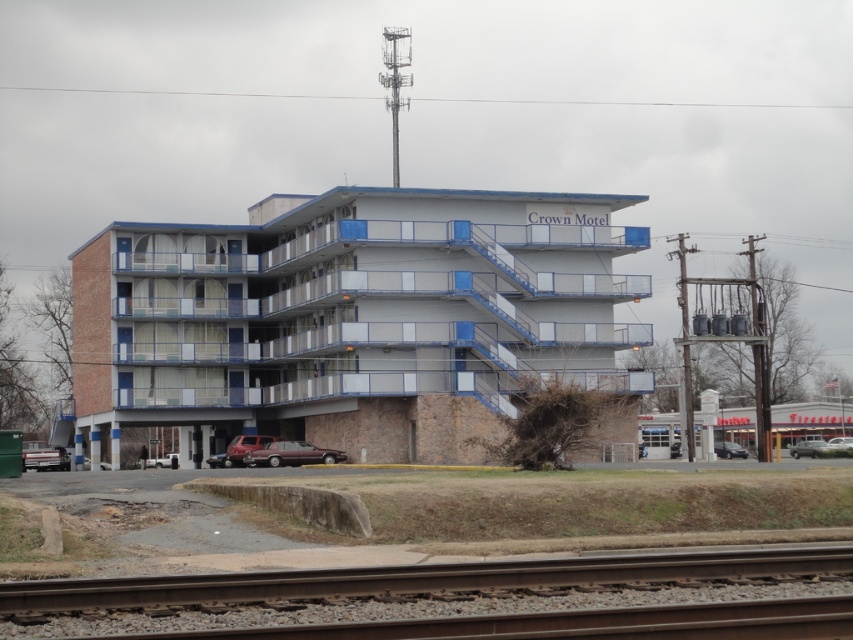
Question: Can you confirm if maroon metallic sedan at center is bigger than dark gray metallic sedan at lower right?

Choices:
 (A) no
 (B) yes

Answer: (A)

Question: Which point is closer to the camera?

Choices:
 (A) metallic silver sedan at lower right
 (B) brown gravel train track at lower center
 (C) metallic maroon sedan at center

Answer: (B)

Question: Is maroon metallic sedan at center below metallic silver sedan at lower right?

Choices:
 (A) yes
 (B) no

Answer: (B)

Question: Based on their relative distances, which object is farther from the maroon metallic sedan at center?

Choices:
 (A) metallic silver sedan at lower right
 (B) metallic maroon sedan at center
 (C) brown gravel train track at lower center
 (D) dark gray metallic sedan at lower right

Answer: (C)

Question: Is metallic maroon sedan at center positioned in front of dark gray metallic sedan at lower right?

Choices:
 (A) yes
 (B) no

Answer: (A)

Question: Which of the following is the farthest from the observer?

Choices:
 (A) (718, 451)
 (B) (231, 444)

Answer: (A)